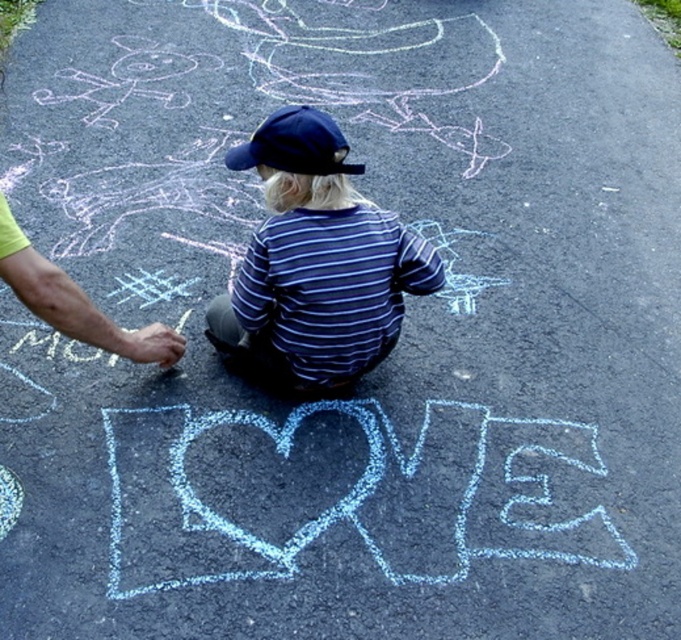
The height and width of the screenshot is (640, 681). I want to click on blue striped shirt at center, so click(x=316, y=260).

Between point (375, 342) and point (279, 134), which one is positioned in front?

Point (279, 134)

Where is `blue striped shirt at center`? The image size is (681, 640). blue striped shirt at center is located at coordinates (316, 260).